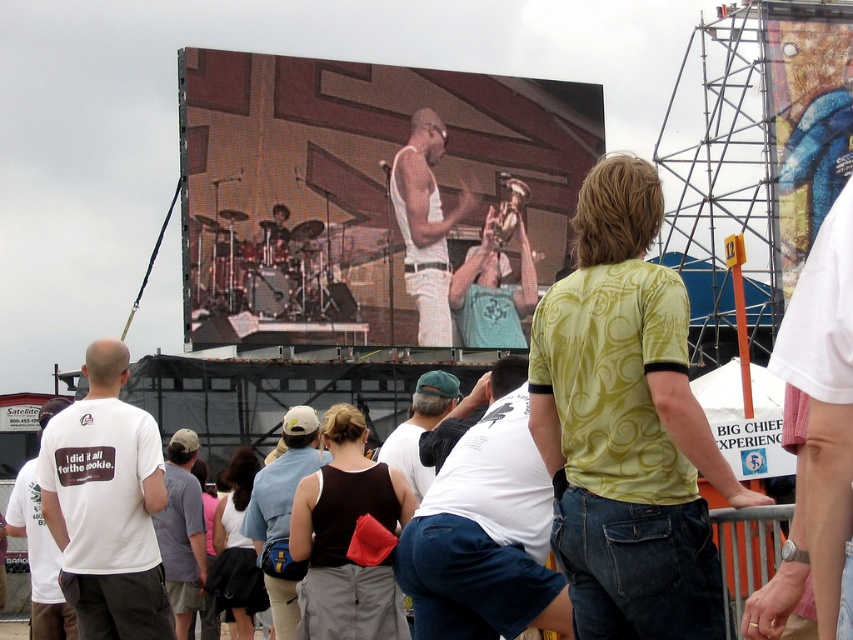
Question: Which object appears farthest from the camera in this image?

Choices:
 (A) white cotton shirt at center
 (B) gray fabric shirt at lower left

Answer: (B)

Question: Does denim shorts at center appear over matte blue t-shirt at center?

Choices:
 (A) yes
 (B) no

Answer: (B)

Question: Which point is closer to the camera?

Choices:
 (A) (276, 614)
 (B) (51, 576)

Answer: (A)

Question: Is white matte t-shirt at center below denim shorts at center?

Choices:
 (A) yes
 (B) no

Answer: (B)

Question: Is white cotton shirt at center to the left of gray fabric shirt at lower left from the viewer's perspective?

Choices:
 (A) no
 (B) yes

Answer: (A)

Question: Which object is the farthest from the matte black screen at center?

Choices:
 (A) gray fabric shirt at lower left
 (B) black fabric tank top at center
 (C) denim shorts at center

Answer: (B)